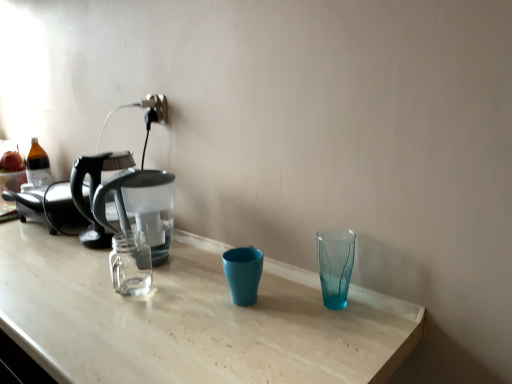
Question: Should I look upward or downward to see transparent glass shot glass at right?

Choices:
 (A) down
 (B) up

Answer: (A)

Question: Does transparent plastic coffee maker at left appear on the right side of transparent glass shot glass at right?

Choices:
 (A) no
 (B) yes

Answer: (A)

Question: Is transparent plastic coffee maker at left oriented towards transparent glass shot glass at right?

Choices:
 (A) yes
 (B) no

Answer: (B)

Question: Considering the relative sizes of transparent plastic coffee maker at left and transparent glass shot glass at right in the image provided, is transparent plastic coffee maker at left wider than transparent glass shot glass at right?

Choices:
 (A) no
 (B) yes

Answer: (B)

Question: From a real-world perspective, is transparent plastic coffee maker at left under transparent glass shot glass at right?

Choices:
 (A) no
 (B) yes

Answer: (A)

Question: Is transparent plastic coffee maker at left taller than transparent glass shot glass at right?

Choices:
 (A) no
 (B) yes

Answer: (B)

Question: Considering the relative sizes of transparent plastic coffee maker at left and transparent glass shot glass at right in the image provided, is transparent plastic coffee maker at left thinner than transparent glass shot glass at right?

Choices:
 (A) no
 (B) yes

Answer: (A)

Question: Is transparent glass shot glass at right not within transparent plastic coffee maker at left?

Choices:
 (A) yes
 (B) no

Answer: (A)

Question: Is transparent glass shot glass at right beside transparent plastic coffee maker at left?

Choices:
 (A) yes
 (B) no

Answer: (B)

Question: Can you confirm if transparent glass shot glass at right is taller than transparent plastic coffee maker at left?

Choices:
 (A) yes
 (B) no

Answer: (B)

Question: Would you say transparent plastic coffee maker at left is part of transparent glass shot glass at right's contents?

Choices:
 (A) yes
 (B) no

Answer: (B)

Question: Considering the relative sizes of transparent glass shot glass at right and transparent plastic coffee maker at left in the image provided, is transparent glass shot glass at right smaller than transparent plastic coffee maker at left?

Choices:
 (A) no
 (B) yes

Answer: (B)

Question: Is transparent glass shot glass at right at the right side of transparent plastic coffee maker at left?

Choices:
 (A) yes
 (B) no

Answer: (A)

Question: Is transparent glass shot glass at right inside or outside of transparent plastic coffee maker at left?

Choices:
 (A) outside
 (B) inside

Answer: (A)